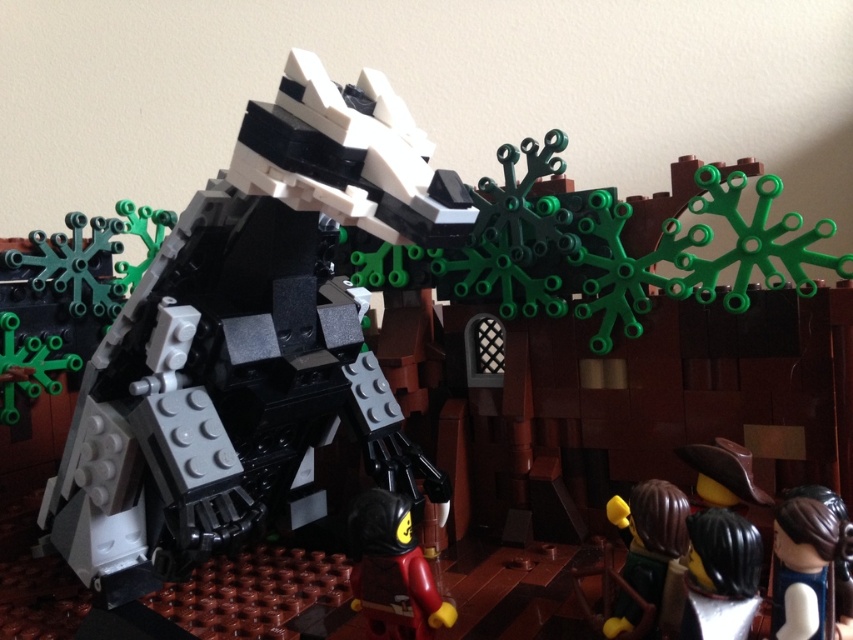
Question: Which point appears closest to the camera in this image?

Choices:
 (A) (743, 582)
 (B) (387, 563)
 (C) (820, 614)

Answer: (C)

Question: Which object is the closest to the black glossy hair at lower right?

Choices:
 (A) smooth brown hair at lower right
 (B) smooth red minifigure at center

Answer: (A)

Question: Which object is farther from the camera taking this photo?

Choices:
 (A) smooth red minifigure at center
 (B) black glossy hair at lower right

Answer: (A)

Question: Can you confirm if smooth brown hair at lower right is thinner than black glossy hair at lower right?

Choices:
 (A) no
 (B) yes

Answer: (A)

Question: Is smooth red minifigure at center to the right of black glossy hair at lower right from the viewer's perspective?

Choices:
 (A) no
 (B) yes

Answer: (A)

Question: Is smooth red minifigure at center below black glossy hair at lower right?

Choices:
 (A) yes
 (B) no

Answer: (A)